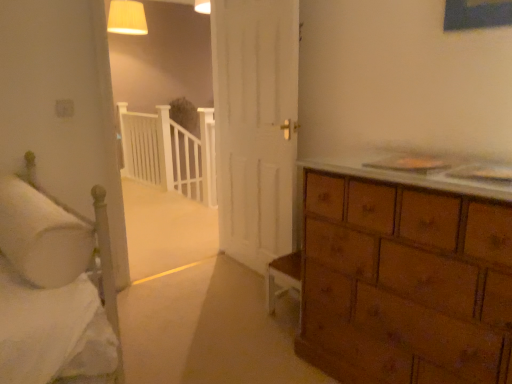
Question: Is white wooden balustrade at center at the right side of matte cream lampshade at upper center?

Choices:
 (A) no
 (B) yes

Answer: (B)

Question: Is white wooden balustrade at center facing away from matte cream lampshade at upper center?

Choices:
 (A) no
 (B) yes

Answer: (A)

Question: Is white wooden balustrade at center bigger than matte cream lampshade at upper center?

Choices:
 (A) no
 (B) yes

Answer: (B)

Question: Is white wooden balustrade at center not close to matte cream lampshade at upper center?

Choices:
 (A) no
 (B) yes

Answer: (B)

Question: Is white wooden balustrade at center behind matte cream lampshade at upper center?

Choices:
 (A) yes
 (B) no

Answer: (A)

Question: Considering the positions of white wooden balustrade at center and matte cream lampshade at upper center in the image, is white wooden balustrade at center taller or shorter than matte cream lampshade at upper center?

Choices:
 (A) tall
 (B) short

Answer: (A)

Question: From a real-world perspective, is white wooden balustrade at center physically located above or below matte cream lampshade at upper center?

Choices:
 (A) below
 (B) above

Answer: (A)

Question: In the image, is white wooden balustrade at center positioned in front of or behind matte cream lampshade at upper center?

Choices:
 (A) behind
 (B) front

Answer: (A)

Question: Does point (162, 142) appear closer or farther from the camera than point (141, 18)?

Choices:
 (A) closer
 (B) farther

Answer: (A)

Question: From the image's perspective, is white soft pillow at left located above or below white wooden balustrade at center?

Choices:
 (A) below
 (B) above

Answer: (A)

Question: Relative to white wooden balustrade at center, is white soft pillow at left in front or behind?

Choices:
 (A) behind
 (B) front

Answer: (B)

Question: Considering the positions of white soft pillow at left and white wooden balustrade at center in the image, is white soft pillow at left taller or shorter than white wooden balustrade at center?

Choices:
 (A) short
 (B) tall

Answer: (A)

Question: Is white soft pillow at left to the left or to the right of white wooden balustrade at center in the image?

Choices:
 (A) right
 (B) left

Answer: (B)

Question: Considering the positions of point (137, 11) and point (41, 236), is point (137, 11) closer or farther from the camera than point (41, 236)?

Choices:
 (A) closer
 (B) farther

Answer: (B)

Question: Choose the correct answer: Is matte cream lampshade at upper center inside white soft pillow at left or outside it?

Choices:
 (A) outside
 (B) inside

Answer: (A)